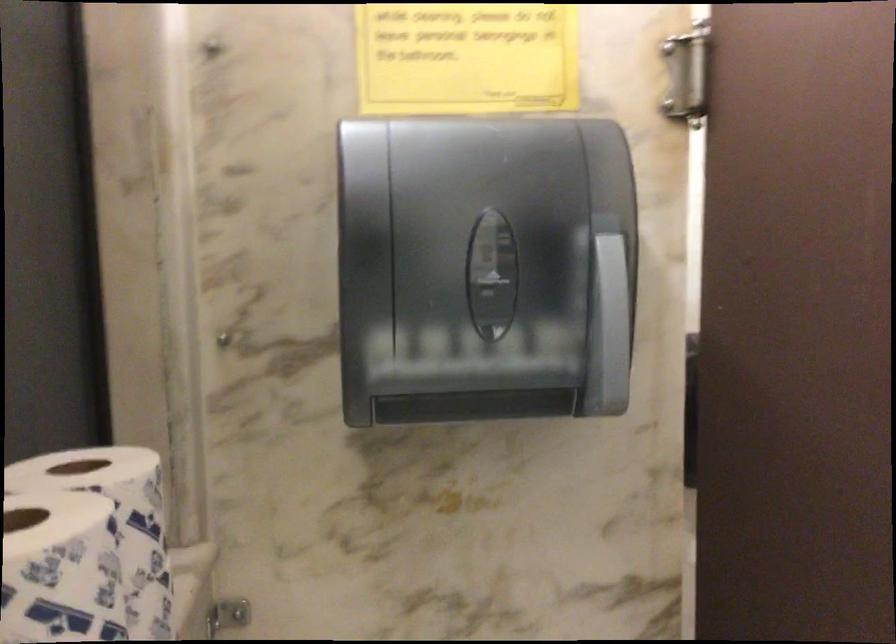
I want to click on paper towel slot, so click(x=490, y=274).